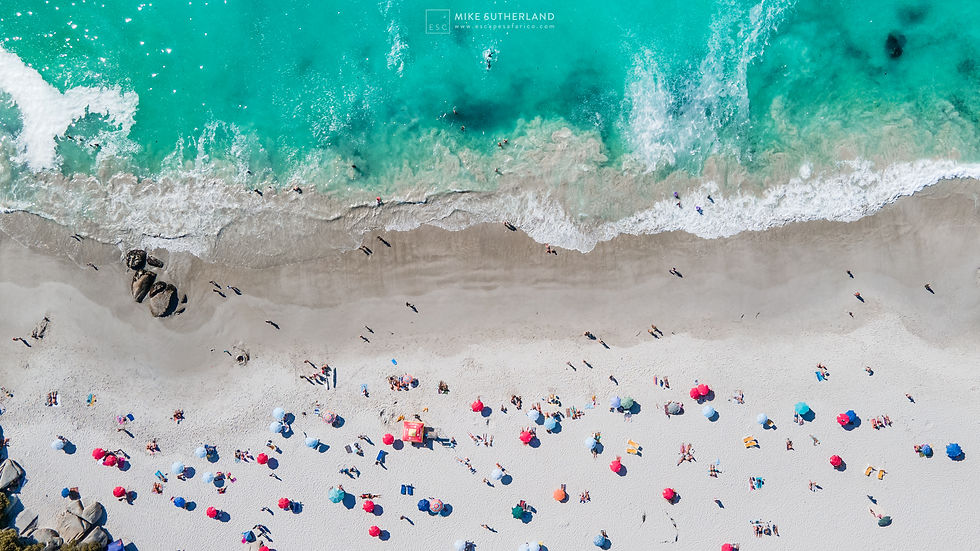
Locate an element on the screen. The height and width of the screenshot is (551, 980). chairs is located at coordinates (750, 445).